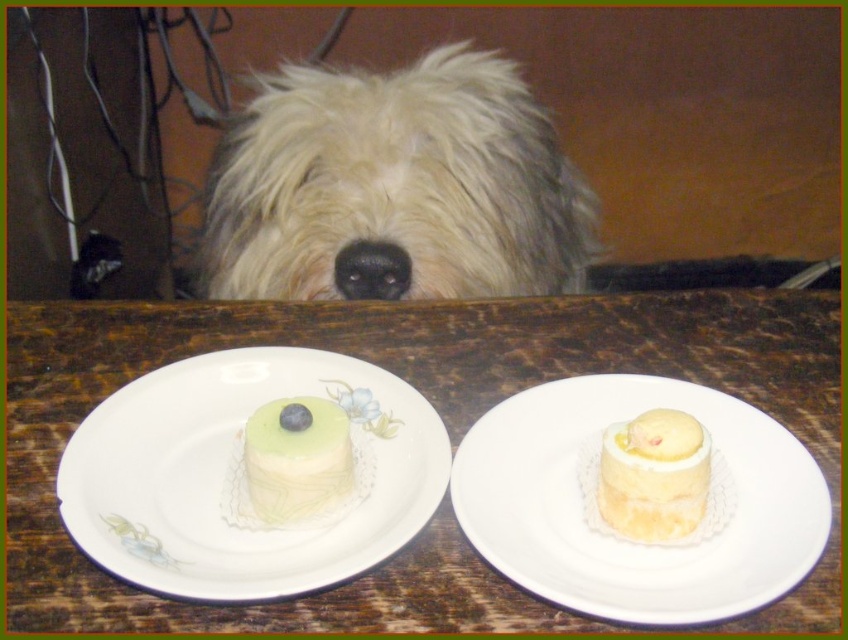
Question: Which of the following is the closest to the observer?

Choices:
 (A) white porcelain plate at center
 (B) yellow frosted cake at right
 (C) green matte cake at center

Answer: (A)

Question: Is white porcelain plate at center wider than black smooth nose at center?

Choices:
 (A) no
 (B) yes

Answer: (B)

Question: Is white fluffy dog at upper center positioned before white ceramic plate at center?

Choices:
 (A) no
 (B) yes

Answer: (A)

Question: Is yellow frosted cake at right further to camera compared to green matte cake at center?

Choices:
 (A) no
 (B) yes

Answer: (A)

Question: Which object appears closest to the camera in this image?

Choices:
 (A) white ceramic plates at center
 (B) green matte cake at center
 (C) white porcelain plate at center

Answer: (C)

Question: Estimate the real-world distances between objects in this image. Which object is closer to the white fluffy dog at upper center?

Choices:
 (A) white porcelain plate at center
 (B) black smooth nose at center

Answer: (B)